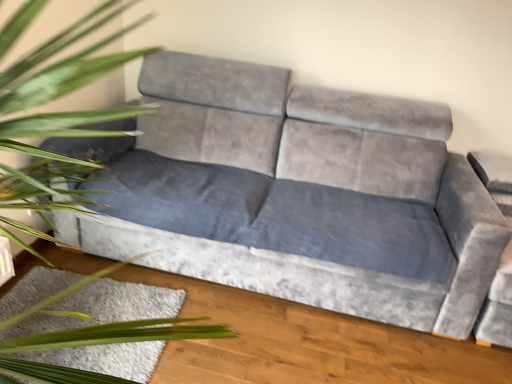
Question: From the image's perspective, relative to green leafy plant at left, is white shaggy rug at lower left above or below?

Choices:
 (A) above
 (B) below

Answer: (B)

Question: Visually, is white shaggy rug at lower left positioned to the left or to the right of green leafy plant at left?

Choices:
 (A) right
 (B) left

Answer: (B)

Question: Considering the real-world distances, which object is farthest from the green leafy plant at left?

Choices:
 (A) white shaggy rug at lower left
 (B) velvet grey couch at center

Answer: (B)

Question: Which of these objects is positioned closest to the white shaggy rug at lower left?

Choices:
 (A) velvet grey couch at center
 (B) green leafy plant at left

Answer: (B)